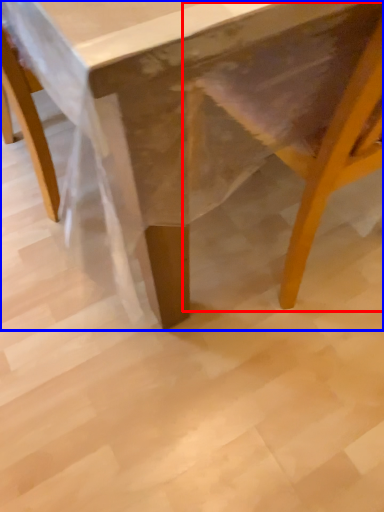
Question: Among these objects, which one is farthest to the camera, swivel chair (highlighted by a red box) or table (highlighted by a blue box)?

Choices:
 (A) swivel chair
 (B) table

Answer: (A)